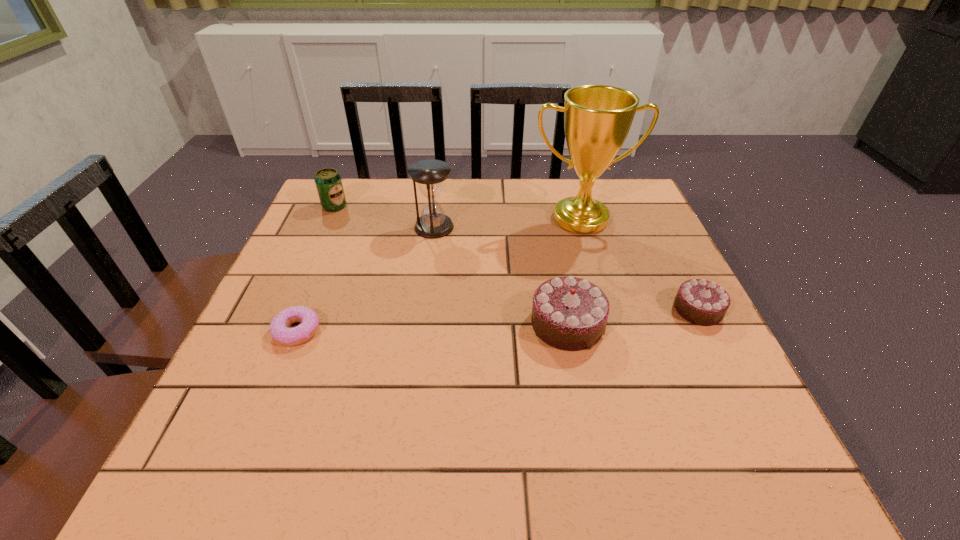
Locate an element on the screen. The image size is (960, 540). free space between the beer can and the hourglass is located at coordinates (384, 217).

You are a GUI agent. You are given a task and a screenshot of the screen. Output one action in this format:
    pyautogui.click(x=<x>, y=<y>)
    Task: Click on the empty space between the doughnut and the beer can
    Image resolution: width=960 pixels, height=540 pixels.
    Given the screenshot: What is the action you would take?
    [x=316, y=269]

The height and width of the screenshot is (540, 960). What are the coordinates of `empty location between the award and the hourglass` in the screenshot? It's located at (507, 223).

Where is `free space between the hourglass and the taller chocolate cake`? free space between the hourglass and the taller chocolate cake is located at coordinates (500, 275).

Where is `free spot between the tallest object and the left chocolate cake`? This screenshot has width=960, height=540. free spot between the tallest object and the left chocolate cake is located at coordinates (573, 271).

Where is `free space between the taller chocolate cake and the award`? Image resolution: width=960 pixels, height=540 pixels. free space between the taller chocolate cake and the award is located at coordinates [573, 271].

Where is `unoccupied position between the rightmost object and the fourth object from right to left`? Image resolution: width=960 pixels, height=540 pixels. unoccupied position between the rightmost object and the fourth object from right to left is located at coordinates (565, 268).

Locate which object is the second closest to the shortest object. Please provide its 2D coordinates. Your answer should be formatted as a tuple, i.e. [(x, y)], where the tuple contains the x and y coordinates of a point satisfying the conditions above.

[(328, 182)]

This screenshot has height=540, width=960. What are the coordinates of `object that is the second closest to the second tallest object` in the screenshot? It's located at (597, 118).

The image size is (960, 540). What are the coordinates of `free location that satisfies the following two spatial constraints: 1. on the front side of the beer can; 2. on the right side of the shorter chocolate cake` in the screenshot? It's located at (289, 309).